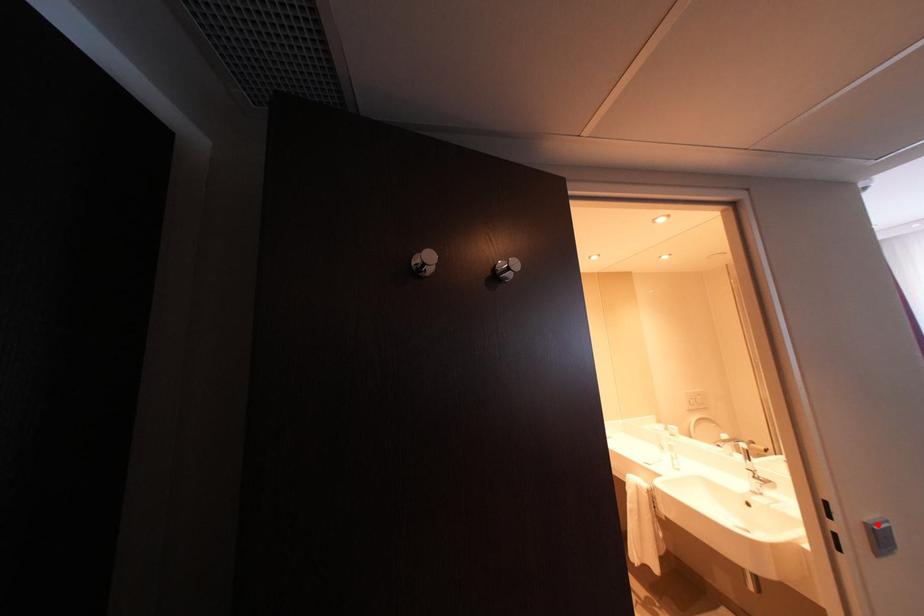
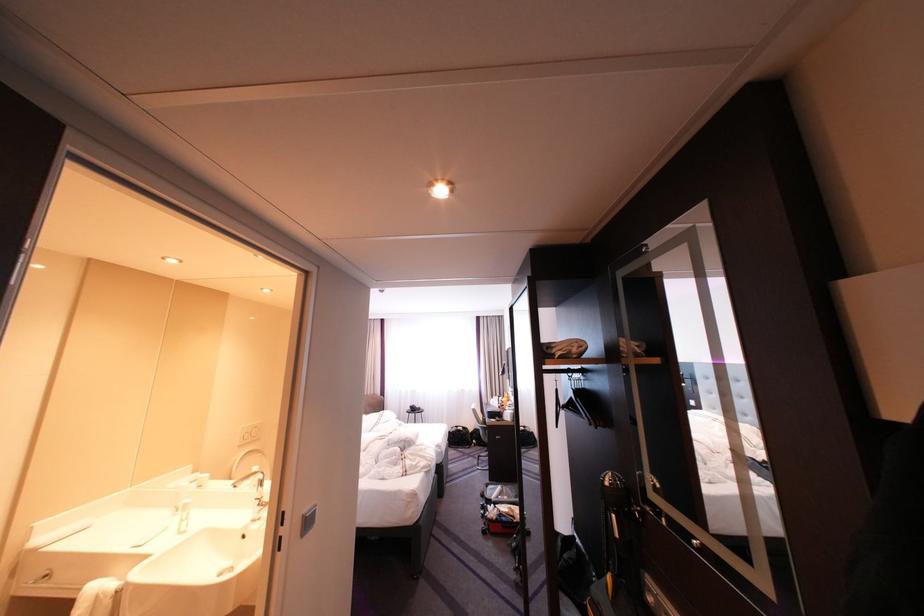
Question: I am providing you with two images of the same scene from different viewpoints. Given a red point in image1, look at the same physical point in image2. Is it:

Choices:
 (A) Closer to the viewpoint
 (B) Farther from the viewpoint

Answer: (B)